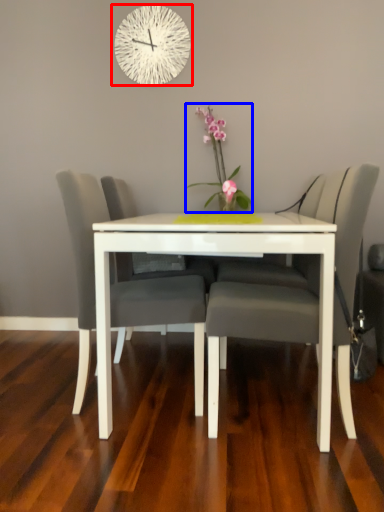
Question: Which object appears farthest to the camera in this image, wall clock (highlighted by a red box) or floral arrangement (highlighted by a blue box)?

Choices:
 (A) wall clock
 (B) floral arrangement

Answer: (A)